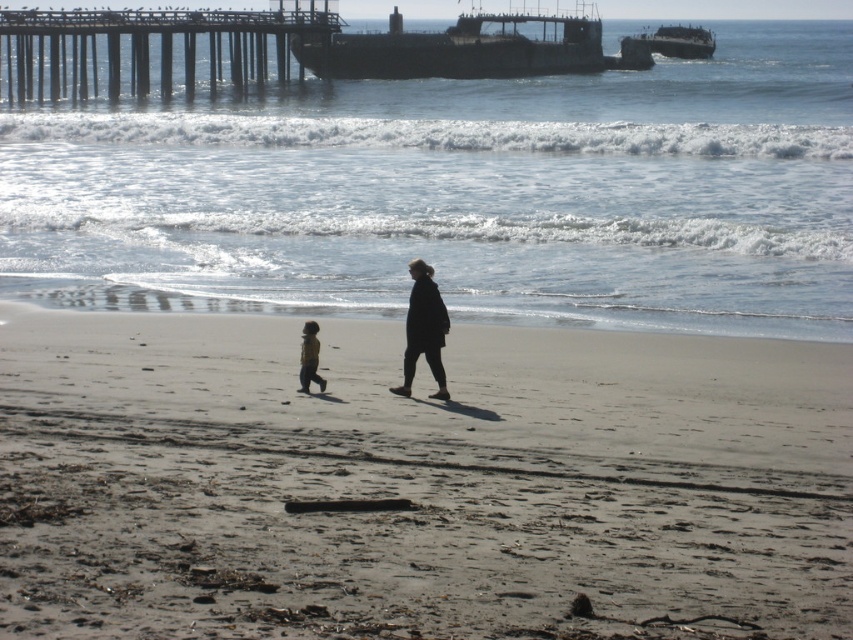
Question: Where is smooth sand at lower center located in relation to dark gray wool coat at center in the image?

Choices:
 (A) right
 (B) left

Answer: (A)

Question: Does dark gray metallic ship at upper center appear under dark gray wool coat at center?

Choices:
 (A) no
 (B) yes

Answer: (A)

Question: Which point appears closest to the camera in this image?

Choices:
 (A) (688, 33)
 (B) (251, 61)

Answer: (B)

Question: Which object appears closest to the camera in this image?

Choices:
 (A) light brown fabric jacket at lower center
 (B) dark gray metallic ship at upper center
 (C) rusty metal shipwreck at upper center

Answer: (A)

Question: Can you confirm if rusty metal shipwreck at upper center is positioned below light brown fabric jacket at lower center?

Choices:
 (A) yes
 (B) no

Answer: (B)

Question: Among these points, which one is nearest to the camera?

Choices:
 (A) (418, 605)
 (B) (602, 67)
 (C) (701, 54)

Answer: (A)